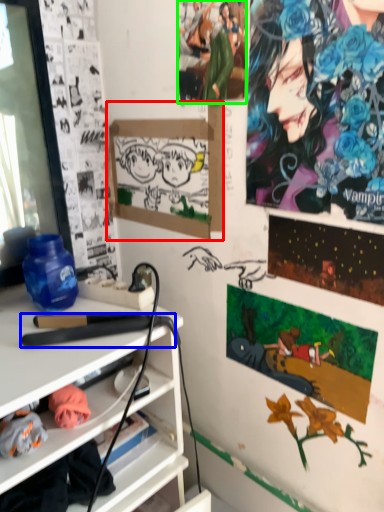
Question: Which object is positioned farthest from bulletin board (highlighted by a red box)? Select from equipment (highlighted by a blue box) and person (highlighted by a green box).

Choices:
 (A) equipment
 (B) person

Answer: (A)